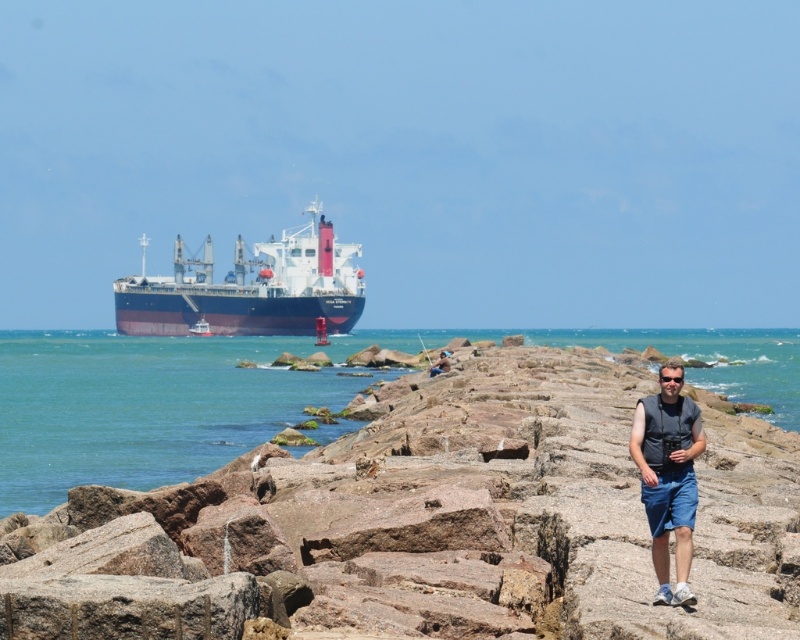
Question: Which of the following is the closest to the observer?

Choices:
 (A) (314, 243)
 (B) (658, 413)
 (C) (430, 374)
 (D) (184, 364)

Answer: (B)

Question: Which of the following is the closest to the observer?

Choices:
 (A) blue denim shorts at center-right
 (B) dark gray vest at center

Answer: (B)

Question: Is dark blue matte cargo ship at center above dark gray vest at center?

Choices:
 (A) yes
 (B) no

Answer: (A)

Question: Does blue water at center have a lesser width compared to blue denim shorts at center-right?

Choices:
 (A) yes
 (B) no

Answer: (B)

Question: Which is farther from the dark blue matte cargo ship at center?

Choices:
 (A) dark gray vest at center
 (B) blue water at center

Answer: (A)

Question: Can you confirm if dark gray vest at center is positioned above blue denim shorts at center-right?

Choices:
 (A) no
 (B) yes

Answer: (A)